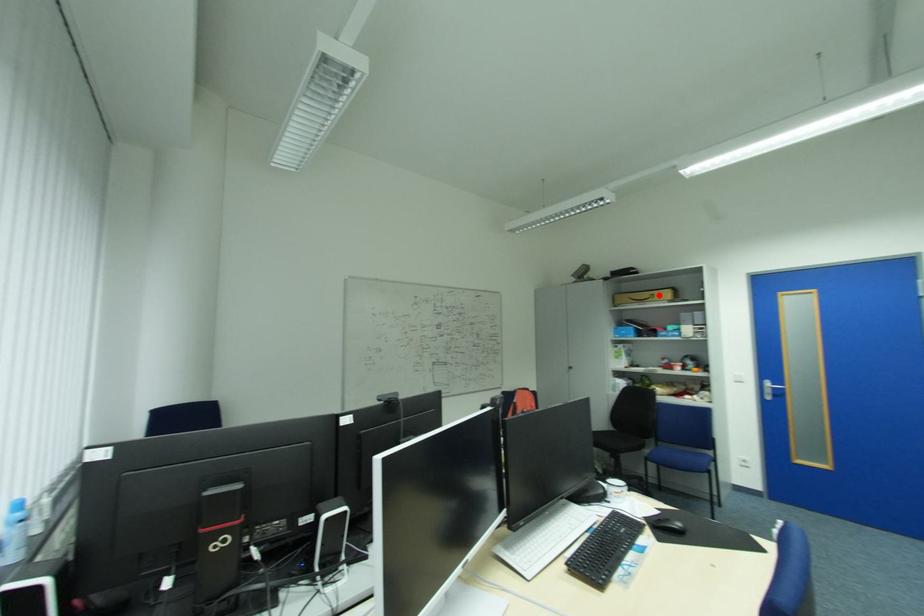
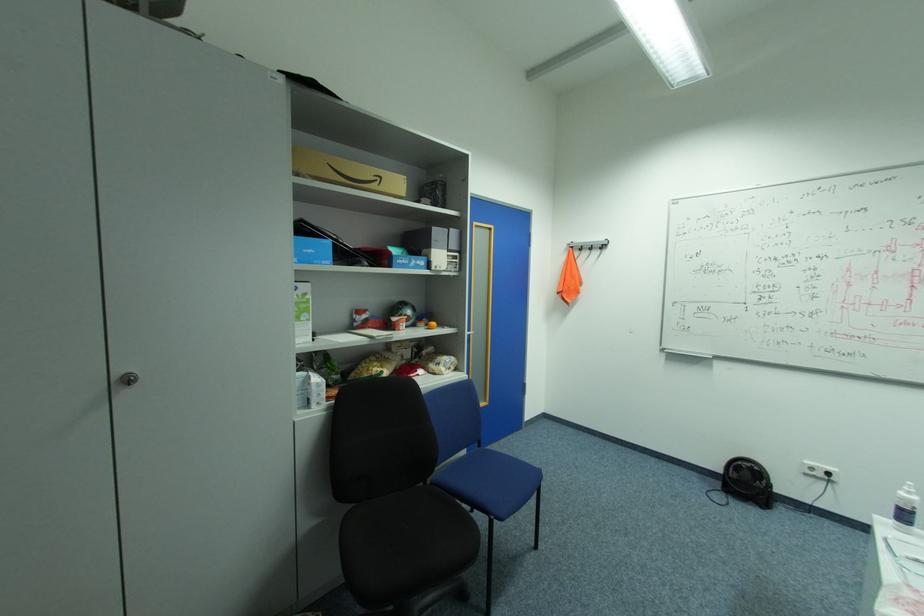
Find the pixel in the second image that matches the highlighted location in the first image.

(386, 177)